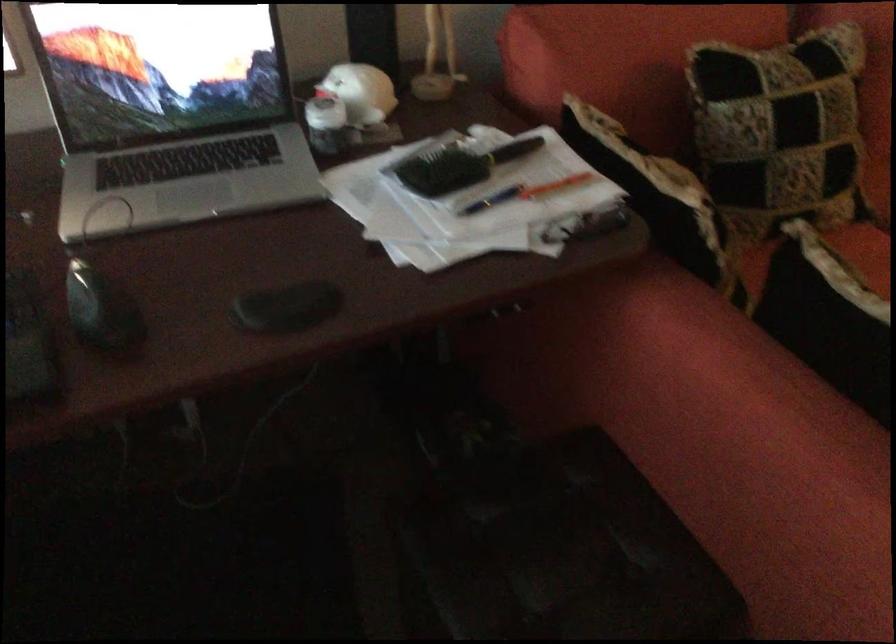
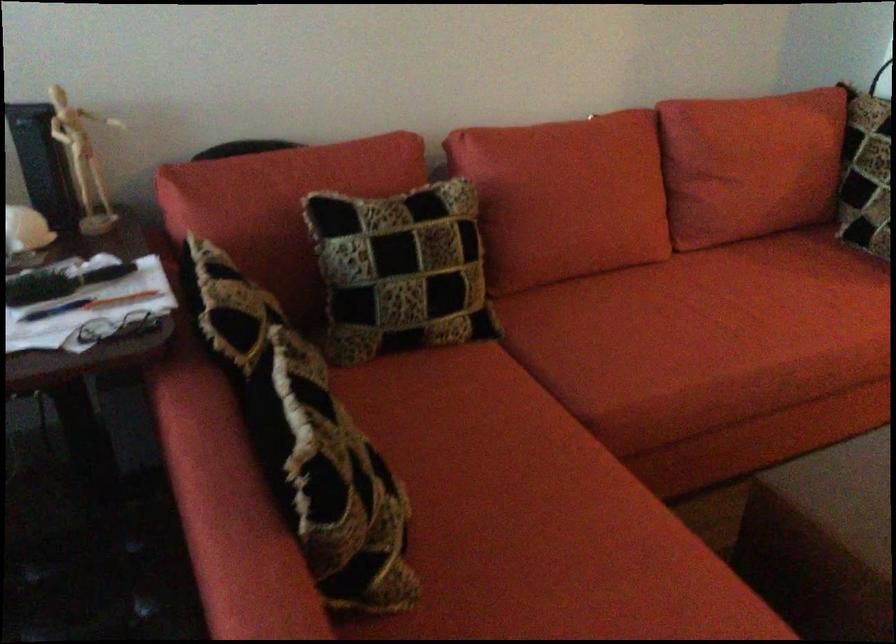
In the second image, find the point that corresponds to (550,175) in the first image.

(122, 299)